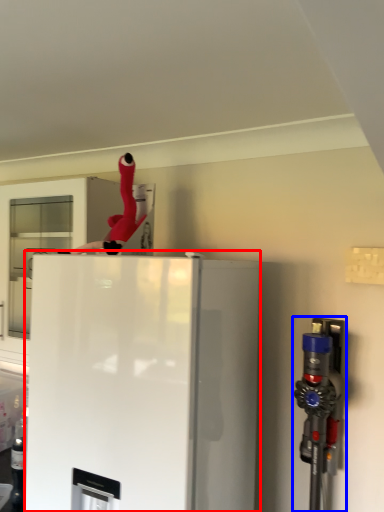
Question: Which object is closer to the camera taking this photo, refrigerator (highlighted by a red box) or appliance (highlighted by a blue box)?

Choices:
 (A) refrigerator
 (B) appliance

Answer: (A)